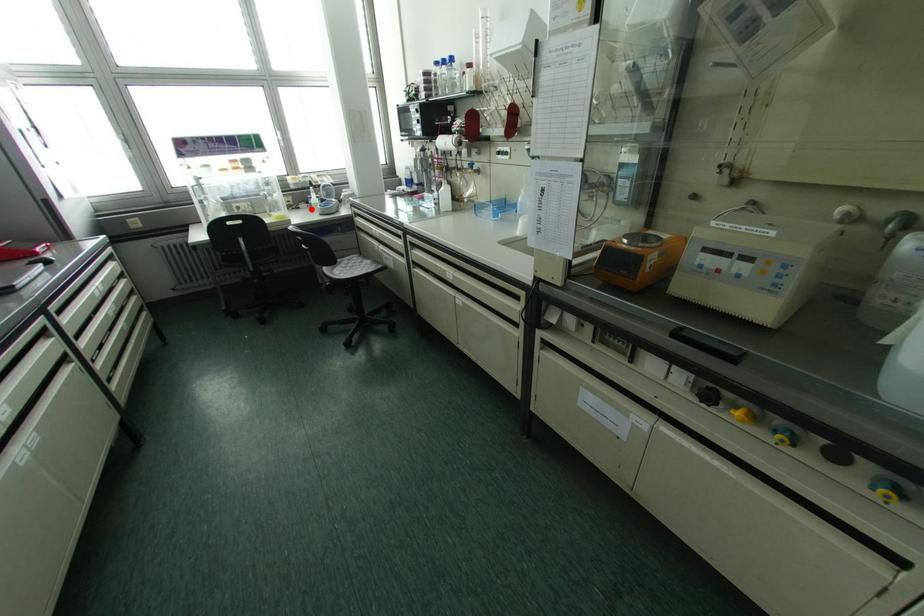
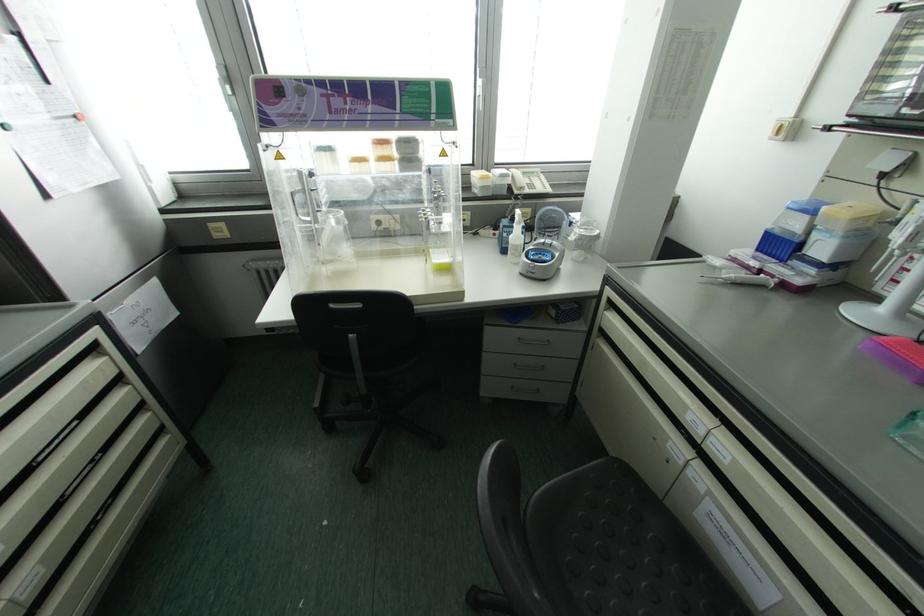
Find the pixel in the second image that matches the highlighted location in the first image.

(504, 251)